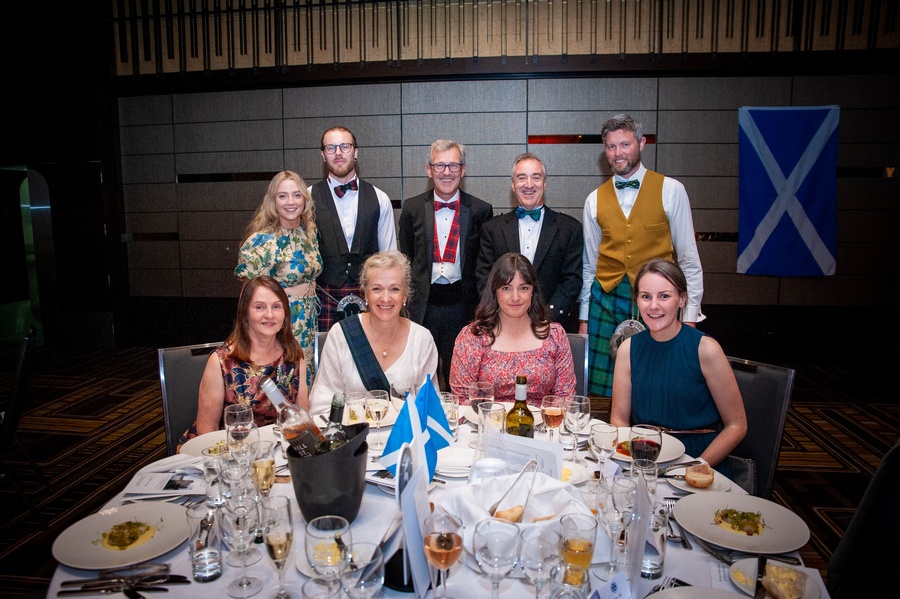
Find the location of a particular element. This screenshot has width=900, height=599. left chair is located at coordinates (181, 356).